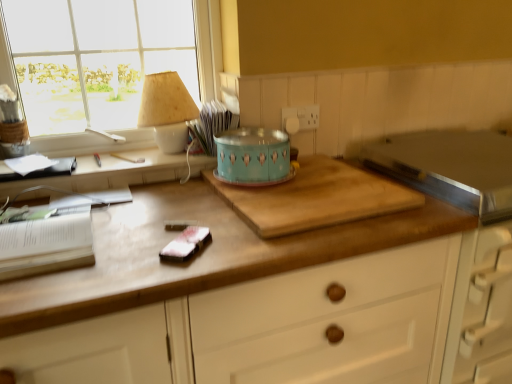
The height and width of the screenshot is (384, 512). I want to click on vacant location behind white paper book at left, so click(112, 193).